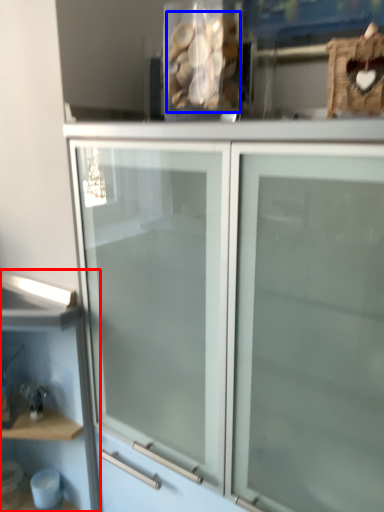
Question: Which point is further to the camera, shelf (highlighted by a red box) or stuff (highlighted by a blue box)?

Choices:
 (A) shelf
 (B) stuff

Answer: (A)